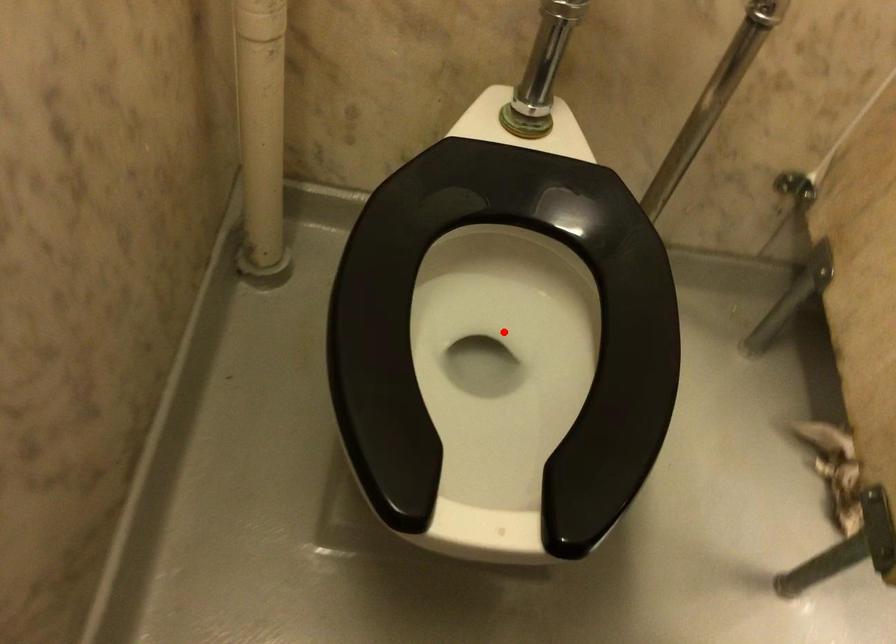
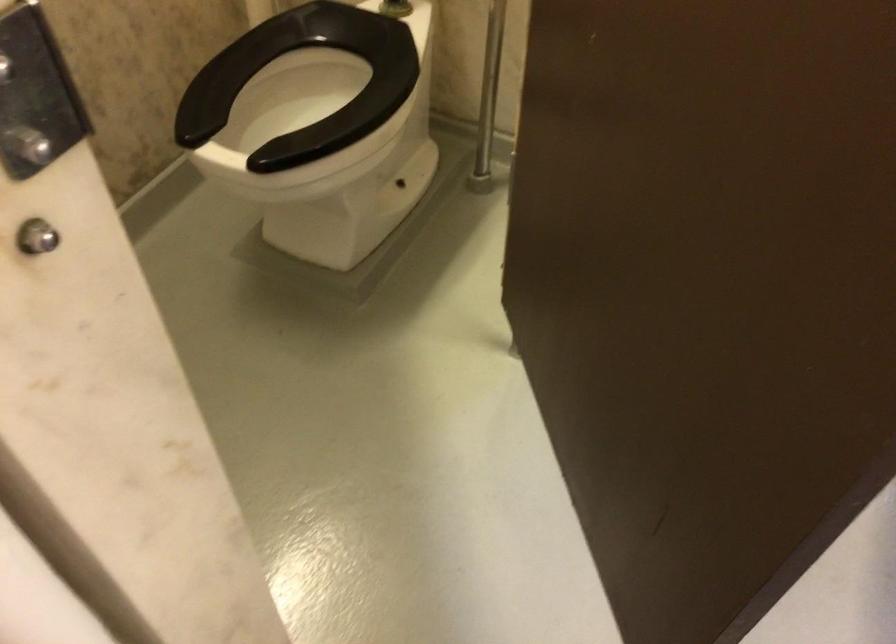
Question: I am providing you with two images of the same scene from different viewpoints. A red point is marked on the first image. Is the red point's position out of view in image 2?

Choices:
 (A) Yes
 (B) No

Answer: (A)